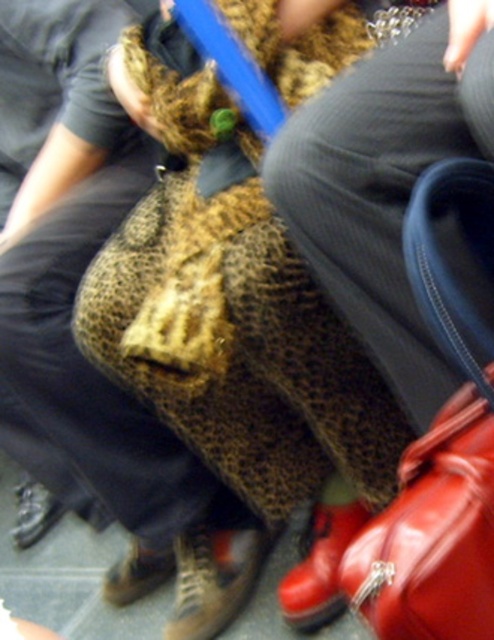
You are trying to place a rectangular object that is 10 cm wide between the leather handbag at lower right and the brown leather shoe at lower center. Can the object fit between them based on their widths?

The leather handbag at lower right is wider than the brown leather shoe at lower center. Since the object is 10 cm wide, but the exact widths of the handbag and shoe are not provided, it is impossible to determine if the space between them can accommodate the object.

You are standing in front of the image and want to locate the point at coordinates point (213,579). Based on the scene description, where exactly is this point located?

The point (213,579) is located on the leather boot at lower center.